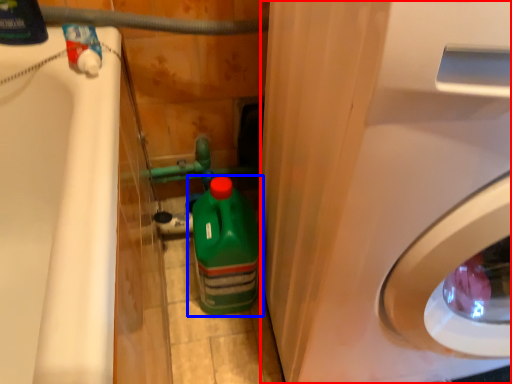
Question: Which point is closer to the camera, washing machine (highlighted by a red box) or bottle (highlighted by a blue box)?

Choices:
 (A) washing machine
 (B) bottle

Answer: (A)